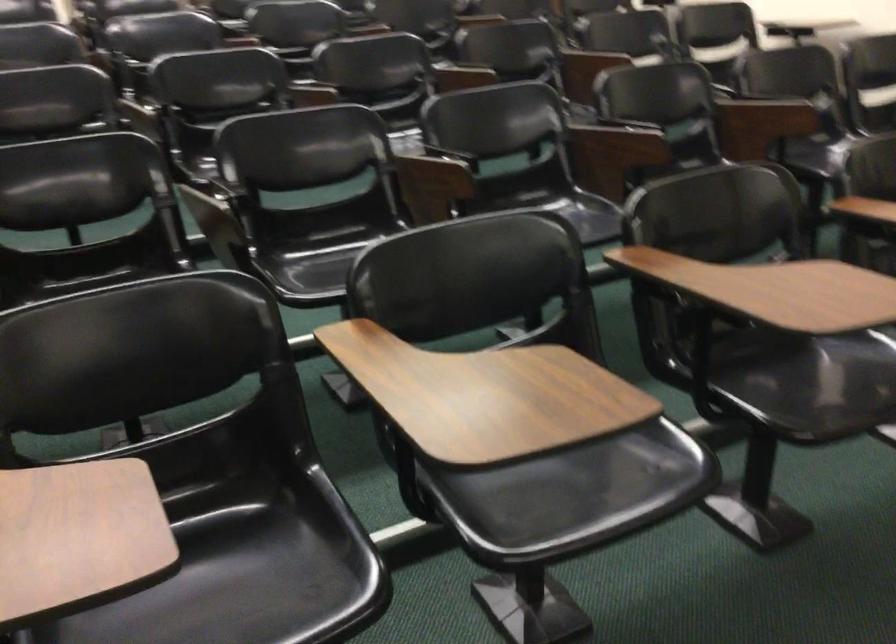
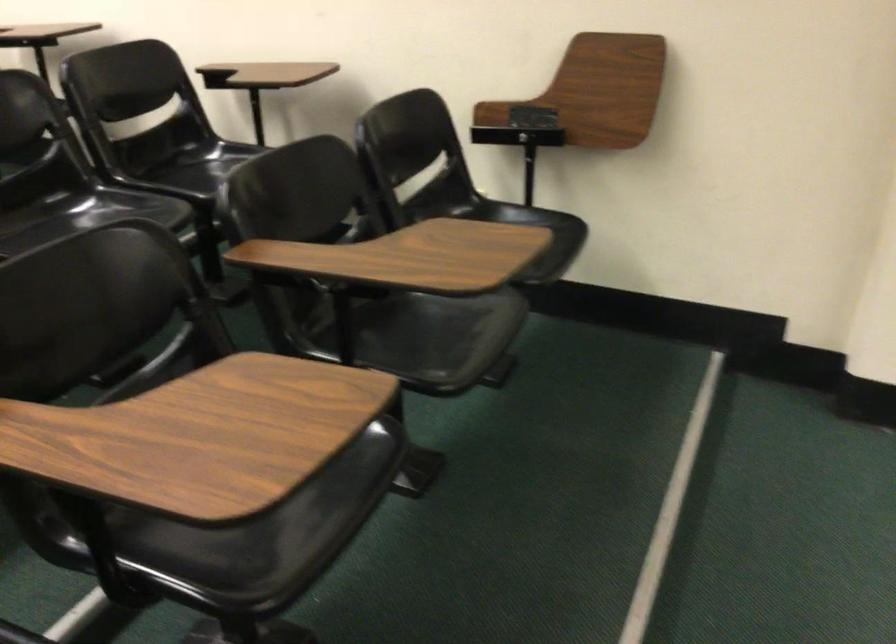
What movement of the cameraman would produce the second image?

The movement direction of the cameraman is right, forward.